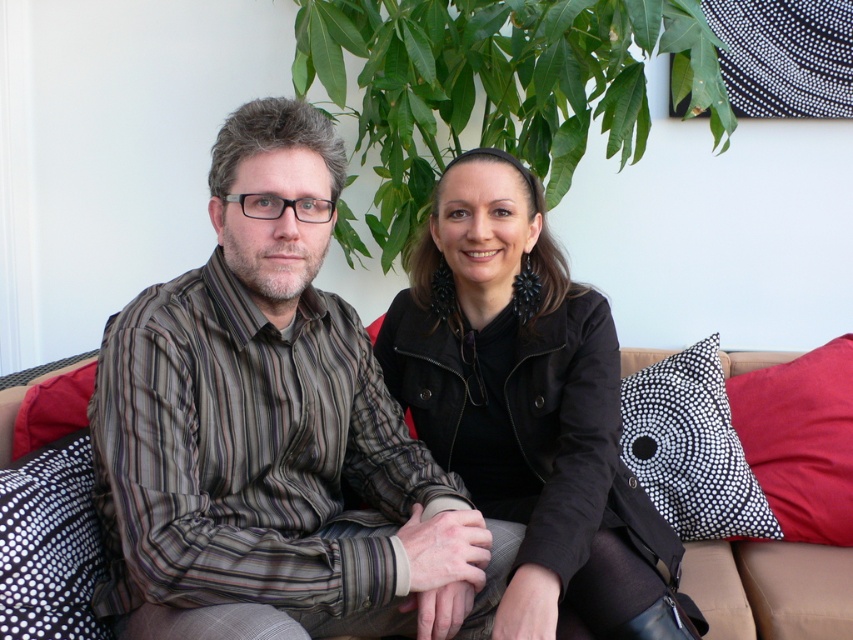
Which is in front, point (238, 429) or point (805, 524)?

Point (238, 429)

Can you confirm if striped cotton shirt at center is positioned to the right of black dotted fabric pillow at right?

In fact, striped cotton shirt at center is to the left of black dotted fabric pillow at right.

At what (x,y) coordinates should I click in order to perform the action: click on striped cotton shirt at center. Please return your answer as a coordinate pair (x, y). Looking at the image, I should click on (271, 433).

Which is behind, point (386, 515) or point (47, 604)?

Positioned behind is point (386, 515).

Does striped cotton shirt at center have a lesser height compared to black dotted pillow at lower left?

Incorrect, striped cotton shirt at center's height does not fall short of black dotted pillow at lower left's.

Measure the distance between striped cotton shirt at center and camera.

striped cotton shirt at center is 37.75 inches away from camera.

I want to click on striped cotton shirt at center, so click(x=271, y=433).

Is beige fabric couch at center further to the viewer compared to black dotted fabric pillow at right?

No.

Is beige fabric couch at center wider than black dotted fabric pillow at right?

Yes.

Identify the location of beige fabric couch at center. (735, 435).

Identify the location of beige fabric couch at center. The height and width of the screenshot is (640, 853). (735, 435).